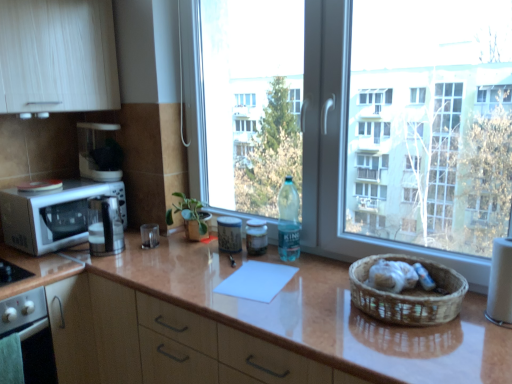
Find the location of a particular element. white glossy oven at lower left is located at coordinates (31, 334).

What do you see at coordinates (344, 149) in the screenshot?
I see `transparent glass window at center` at bounding box center [344, 149].

Identify the location of satin silver coffee machine at center. Image resolution: width=512 pixels, height=384 pixels. (105, 226).

The height and width of the screenshot is (384, 512). What do you see at coordinates (105, 226) in the screenshot?
I see `satin silver coffee machine at center` at bounding box center [105, 226].

Describe the element at coordinates (53, 215) in the screenshot. I see `white glossy microwave oven at left` at that location.

What do you see at coordinates (229, 234) in the screenshot? The height and width of the screenshot is (384, 512). I see `matte glass jar at center, the 3th appliance positioned from the bottom` at bounding box center [229, 234].

This screenshot has width=512, height=384. What are the coordinates of `white glossy oven at lower left` in the screenshot? It's located at (31, 334).

Does glossy brown countertop at center come in front of white glossy oven at lower left?

Yes, glossy brown countertop at center is closer to the viewer.

Is glossy brown countertop at center to the left of white glossy oven at lower left from the viewer's perspective?

Incorrect, glossy brown countertop at center is not on the left side of white glossy oven at lower left.

From their relative heights in the image, would you say glossy brown countertop at center is taller or shorter than white glossy oven at lower left?

In the image, glossy brown countertop at center appears to be taller than white glossy oven at lower left.

Is white glossy oven at lower left at the back of glossy brown countertop at center?

glossy brown countertop at center does not have its back to white glossy oven at lower left.

Based on the photo, which of these two, satin silver coffee machine at center or glossy brown countertop at center, is bigger?

glossy brown countertop at center.

Considering the positions of objects satin silver coffee machine at center and glossy brown countertop at center in the image provided, who is in front, satin silver coffee machine at center or glossy brown countertop at center?

glossy brown countertop at center is closer to the camera.

Can you tell me how much satin silver coffee machine at center and glossy brown countertop at center differ in facing direction?

They differ by 58.1 degrees in their facing directions.

From a real-world perspective, between satin silver coffee machine at center and glossy brown countertop at center, who is vertically higher?

In real-world perspective, satin silver coffee machine at center is above.

Is white paper towel at right, which ranks as the 1th appliance in bottom-to-top order, bigger or smaller than white glossy microwave oven at left?

Clearly, white paper towel at right, which ranks as the 1th appliance in bottom-to-top order, is smaller in size than white glossy microwave oven at left.

From the image's perspective, is white paper towel at right, which ranks as the 1th appliance in bottom-to-top order, located above or below white glossy microwave oven at left?

white paper towel at right, which ranks as the 1th appliance in bottom-to-top order, is below white glossy microwave oven at left.

How far apart are white paper towel at right, which appears as the first appliance when viewed from the right, and white glossy microwave oven at left?

They are 1.66 meters apart.

Between white paper towel at right, arranged as the 1th appliance when viewed from the front, and white glossy microwave oven at left, which one appears on the left side from the viewer's perspective?

Positioned to the left is white glossy microwave oven at left.

Considering the points (263, 238) and (69, 343), which point is behind, point (263, 238) or point (69, 343)?

Point (263, 238)

Which of these two, matte glass jar at center, which is counted as the second appliance, starting from the right, or glossy brown countertop at center, is thinner?

matte glass jar at center, which is counted as the second appliance, starting from the right, is thinner.

Can you confirm if matte glass jar at center, which is counted as the second appliance, starting from the right, is shorter than glossy brown countertop at center?

Correct, matte glass jar at center, which is counted as the second appliance, starting from the right, is not as tall as glossy brown countertop at center.

Is matte glass jar at center, which ranks as the second appliance in front-to-back order, far from white glossy microwave oven at left?

Actually, matte glass jar at center, which ranks as the second appliance in front-to-back order, and white glossy microwave oven at left are a little close together.

In the image, is matte glass jar at center, which is the 3th appliance from back to front, on the left side or the right side of white glossy microwave oven at left?

From the image, it's evident that matte glass jar at center, which is the 3th appliance from back to front, is to the right of white glossy microwave oven at left.

Who is smaller, matte glass jar at center, which ranks as the second appliance in front-to-back order, or white glossy microwave oven at left?

matte glass jar at center, which ranks as the second appliance in front-to-back order.

Based on the photo, can you confirm if matte glass jar at center, the 2th appliance positioned from the bottom, is thinner than white glossy microwave oven at left?

Indeed, matte glass jar at center, the 2th appliance positioned from the bottom, has a lesser width compared to white glossy microwave oven at left.

Which of these two, white glossy oven at lower left or matte glass jar at center, which ranks as the second appliance in front-to-back order, is bigger?

With larger size is white glossy oven at lower left.

Considering the sizes of objects white glossy oven at lower left and matte glass jar at center, the 2th appliance positioned from the bottom, in the image provided, who is wider, white glossy oven at lower left or matte glass jar at center, the 2th appliance positioned from the bottom,?

Wider between the two is white glossy oven at lower left.

Is white glossy oven at lower left directly adjacent to matte glass jar at center, the 2th appliance positioned from the bottom?

No, white glossy oven at lower left is not with matte glass jar at center, the 2th appliance positioned from the bottom.

How many degrees apart are the facing directions of matte glass jar at center, marked as the 3th appliance in a top-to-bottom arrangement, and white paper towel at right, the 4th appliance from the left?

matte glass jar at center, marked as the 3th appliance in a top-to-bottom arrangement, and white paper towel at right, the 4th appliance from the left, are facing 0.325 degrees away from each other.

Does matte glass jar at center, which is counted as the second appliance, starting from the right, have a larger size compared to white paper towel at right, which ranks as the 1th appliance in bottom-to-top order?

No, matte glass jar at center, which is counted as the second appliance, starting from the right, is not bigger than white paper towel at right, which ranks as the 1th appliance in bottom-to-top order.

Looking at this image, who is more distant, matte glass jar at center, the 2th appliance positioned from the bottom, or white paper towel at right, which appears as the first appliance when viewed from the right?

matte glass jar at center, the 2th appliance positioned from the bottom, is further away from the camera.

Which object is wider, matte glass jar at center, marked as the 3th appliance in a top-to-bottom arrangement, or white paper towel at right, which appears as the first appliance when viewed from the right?

With larger width is white paper towel at right, which appears as the first appliance when viewed from the right.

Find the location of `oven behind the glossy brown countertop at center`. oven behind the glossy brown countertop at center is located at coordinates (31, 334).

You are a GUI agent. You are given a task and a screenshot of the screen. Output one action in this format:
    pyautogui.click(x=<x>, y=<y>)
    Task: Click on the countertop below the satin silver coffee machine at center (from the image's perspective)
    
    Given the screenshot: What is the action you would take?
    pyautogui.click(x=241, y=324)

From the image, which object appears to be nearer to white glossy oven at lower left, satin silver coffee machine at center or matte glass jar at center, the second appliance when ordered from top to bottom?

Based on the image, satin silver coffee machine at center appears to be nearer to white glossy oven at lower left.

Looking at the image, which one is located closer to white glossy microwave oven at left, brown woven basket at right or matte glass jar at center, which is the 3th appliance from back to front?

Among the two, matte glass jar at center, which is the 3th appliance from back to front, is located nearer to white glossy microwave oven at left.

Estimate the real-world distances between objects in this image. Which object is closer to white glossy microwave oven at left, matte glass jar at center, the second appliance when ordered from top to bottom, or matte white coffee maker at upper left, the 4th appliance in the front-to-back sequence?

matte white coffee maker at upper left, the 4th appliance in the front-to-back sequence, is closer to white glossy microwave oven at left.

Looking at the image, which one is located closer to matte glass jar at center, which ranks as the 3th appliance in right-to-left order, transparent glass window at center or satin silver coffee machine at center?

transparent glass window at center.

Consider the image. Which object lies further to the anchor point transparent glass window at center, matte glass jar at center, marked as the third appliance in a left-to-right arrangement, or matte white coffee maker at upper left, the 1th appliance viewed from the back?

The object further to transparent glass window at center is matte white coffee maker at upper left, the 1th appliance viewed from the back.

Considering their positions, is white paper towel at right, arranged as the 1th appliance when viewed from the front, positioned further to white glossy oven at lower left than matte glass jar at center, positioned as the 3th appliance in front-to-back order?

white paper towel at right, arranged as the 1th appliance when viewed from the front.

Consider the image. Considering their positions, is white glossy oven at lower left positioned further to glossy brown countertop at center than white glossy microwave oven at left?

Based on the image, white glossy microwave oven at left appears to be further to glossy brown countertop at center.

Considering their positions, is satin silver coffee machine at center positioned closer to matte white coffee maker at upper left, the 4th appliance in the front-to-back sequence, than brown woven basket at right?

Among the two, satin silver coffee machine at center is located nearer to matte white coffee maker at upper left, the 4th appliance in the front-to-back sequence.

Where is `microwave oven that lies between matte white coffee maker at upper left, the first appliance positioned from the left, and satin silver coffee machine at center from top to bottom`? microwave oven that lies between matte white coffee maker at upper left, the first appliance positioned from the left, and satin silver coffee machine at center from top to bottom is located at coordinates (53, 215).

At what (x,y) coordinates should I click in order to perform the action: click on basket between matte white coffee maker at upper left, acting as the 1th appliance starting from the top, and white paper towel at right, the fourth appliance when ordered from top to bottom, from left to right. Please return your answer as a coordinate pair (x, y). The image size is (512, 384). Looking at the image, I should click on (408, 294).

Locate an element on the screen. basket between transparent glass window at center and glossy brown countertop at center vertically is located at coordinates (408, 294).

Identify the location of coffee machine situated between white glossy oven at lower left and transparent glass window at center from left to right. This screenshot has width=512, height=384. 105,226.